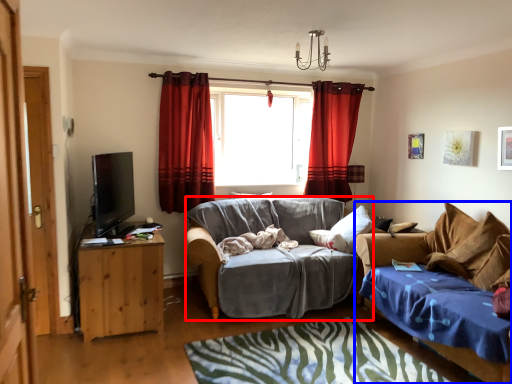
Question: Among these objects, which one is nearest to the camera, studio couch (highlighted by a red box) or studio couch (highlighted by a blue box)?

Choices:
 (A) studio couch
 (B) studio couch

Answer: (B)